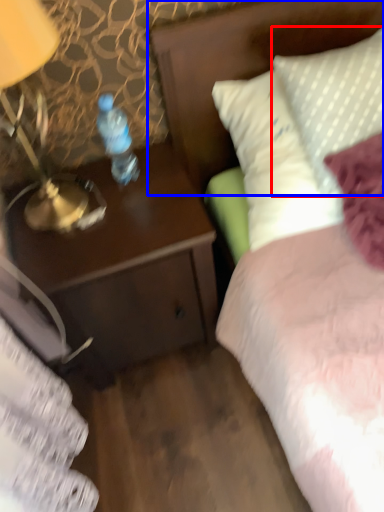
Question: Which object is closer to the camera taking this photo, pillow (highlighted by a red box) or headboard (highlighted by a blue box)?

Choices:
 (A) pillow
 (B) headboard

Answer: (A)